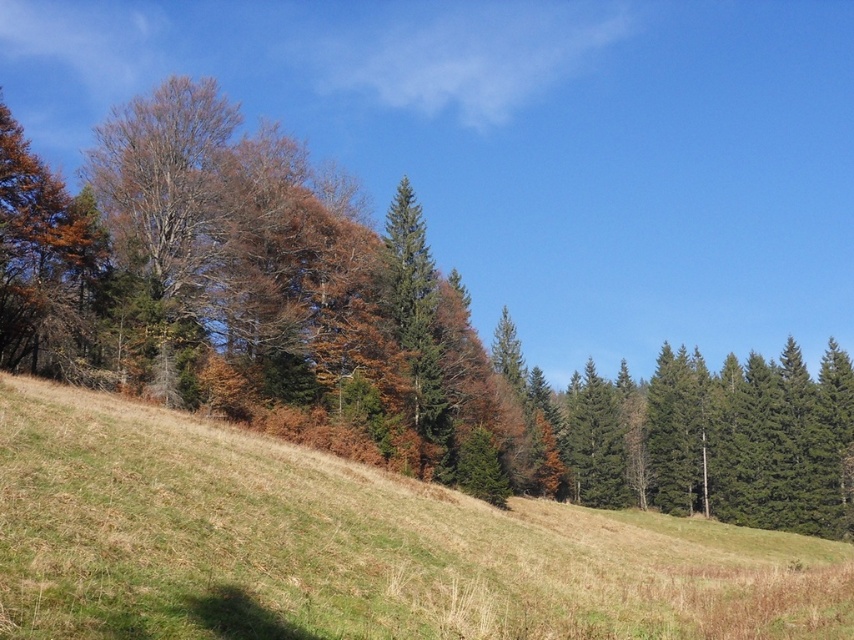
Question: Can you confirm if brown matte tree at left is wider than brown grassy hillside at center?

Choices:
 (A) yes
 (B) no

Answer: (A)

Question: Which object is closer to the camera taking this photo?

Choices:
 (A) brown matte tree at left
 (B) brown grassy hillside at center

Answer: (B)

Question: Can you confirm if brown matte tree at left is smaller than brown grassy hillside at center?

Choices:
 (A) no
 (B) yes

Answer: (A)

Question: Can you confirm if brown matte tree at left is positioned to the right of brown grassy hillside at center?

Choices:
 (A) yes
 (B) no

Answer: (A)